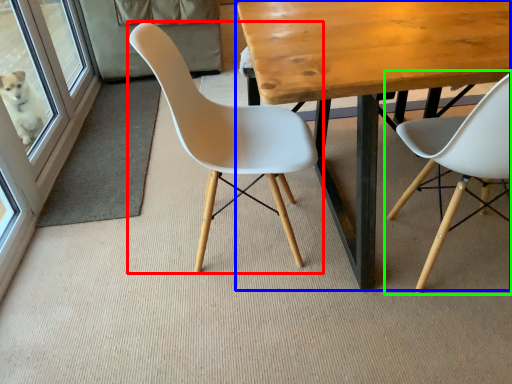
Question: Which object is the closest to the chair (highlighted by a red box)? Choose among these: table (highlighted by a blue box) or chair (highlighted by a green box).

Choices:
 (A) table
 (B) chair

Answer: (A)